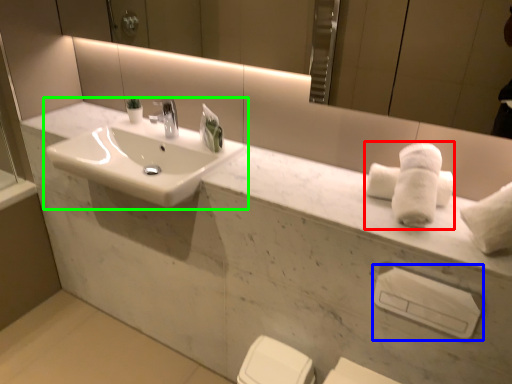
Question: Which is nearer to the bath towel (highlighted by a red box)? towel bar (highlighted by a blue box) or sink (highlighted by a green box).

Choices:
 (A) towel bar
 (B) sink

Answer: (A)